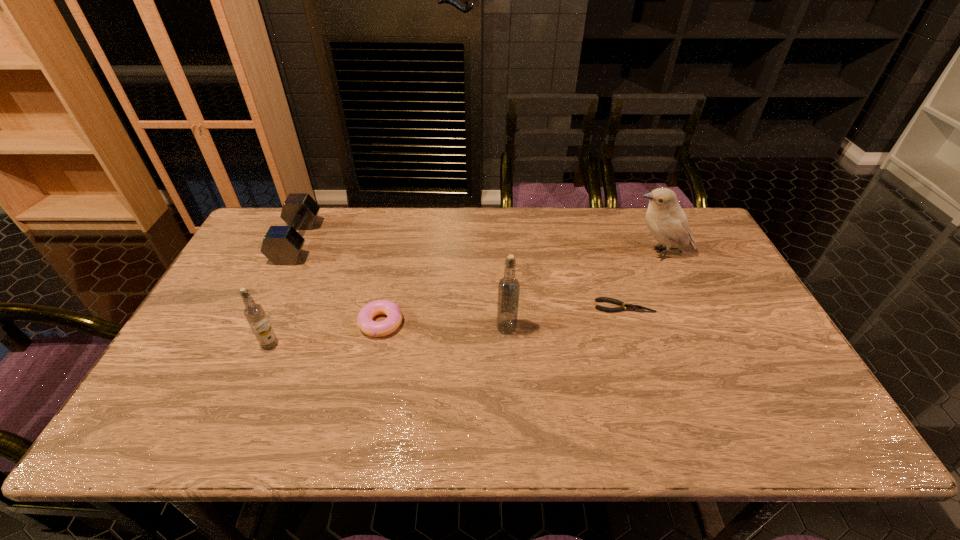
Observe the arrangement of all vodkas in the image. To keep them evenly spaced, where would you place another vodka on the right? Please locate a free space. Please provide its 2D coordinates. Your answer should be formatted as a tuple, i.e. [(x, y)], where the tuple contains the x and y coordinates of a point satisfying the conditions above.

[(727, 312)]